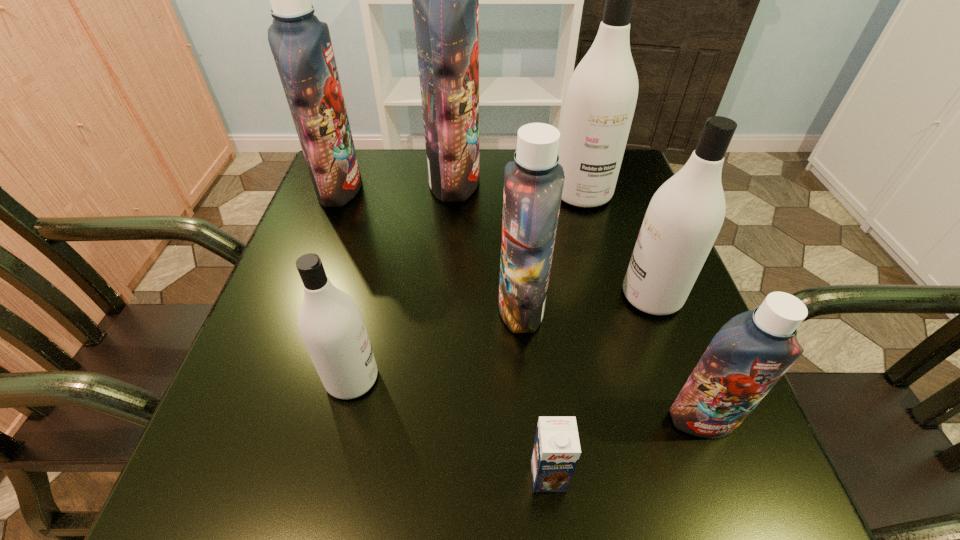
I want to click on the nearest blue shampoo, so click(x=750, y=353).

Image resolution: width=960 pixels, height=540 pixels. In order to click on the rightmost blue shampoo in this screenshot , I will do `click(750, 353)`.

Image resolution: width=960 pixels, height=540 pixels. I want to click on chocolate milk, so click(x=556, y=450).

Find the location of a particular element. The height and width of the screenshot is (540, 960). the shortest object is located at coordinates 556,450.

This screenshot has height=540, width=960. What are the coordinates of `vacant space located 0.140m on the front label of the second blue shampoo from left to right` in the screenshot? It's located at (534, 180).

Locate an element on the screen. blank space located 0.220m on the front label of the leftmost blue shampoo is located at coordinates (449, 188).

The image size is (960, 540). In order to click on vacant space located on the front-facing side of the biggest white shampoo in this screenshot , I will do `click(615, 314)`.

At what (x,y) coordinates should I click in order to perform the action: click on free spot located 0.070m on the front label of the fourth shampoo from left to right. Please return your answer as a coordinate pair (x, y). The image size is (960, 540). Looking at the image, I should click on (462, 307).

Where is `blank space located 0.310m on the front label of the fourth shampoo from left to right`? This screenshot has height=540, width=960. blank space located 0.310m on the front label of the fourth shampoo from left to right is located at coordinates pyautogui.click(x=336, y=307).

This screenshot has width=960, height=540. Find the location of `vacant position located 0.310m on the front label of the fourth shampoo from left to right`. vacant position located 0.310m on the front label of the fourth shampoo from left to right is located at coordinates (336, 307).